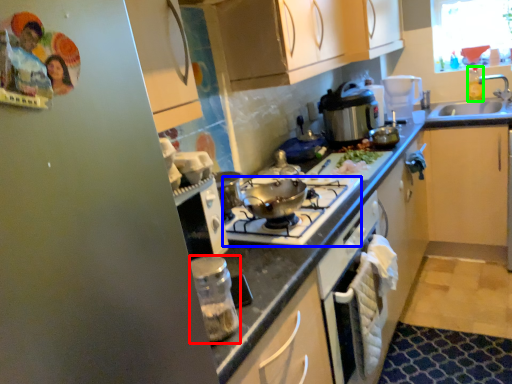
Question: Which object is the closest to the kitchen appliance (highlighted by a red box)? Choose among these: gas stove (highlighted by a blue box) or bottle (highlighted by a green box).

Choices:
 (A) gas stove
 (B) bottle

Answer: (A)